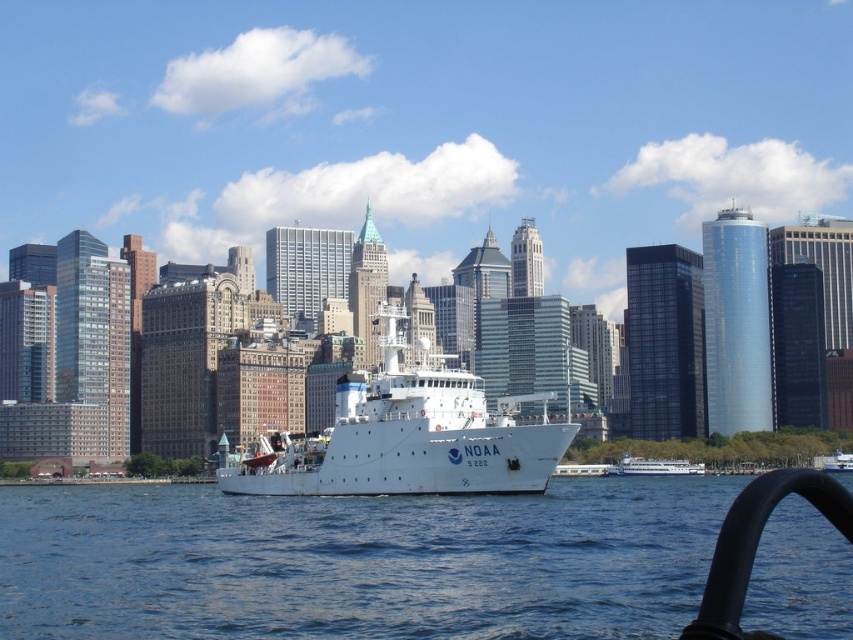
Who is taller, white matte ship at center or white glossy ferry at center?

Standing taller between the two is white matte ship at center.

I want to click on white matte ship at center, so click(409, 436).

Is blue water at center to the right of white glossy ferry at center from the viewer's perspective?

No, blue water at center is not to the right of white glossy ferry at center.

Which is above, blue water at center or white glossy ferry at center?

blue water at center

Who is more forward, (192,492) or (619,460)?

Point (192,492) is in front.

Locate an element on the screen. The height and width of the screenshot is (640, 853). blue water at center is located at coordinates (358, 563).

Measure the distance between blue water at center and white matte ship at center.

A distance of 18.01 meters exists between blue water at center and white matte ship at center.

Between blue water at center and white matte ship at center, which one appears on the left side from the viewer's perspective?

From the viewer's perspective, white matte ship at center appears more on the left side.

Does point (9, 561) lie behind point (398, 378)?

No, (9, 561) is in front of (398, 378).

In order to click on blue water at center in this screenshot , I will do `click(358, 563)`.